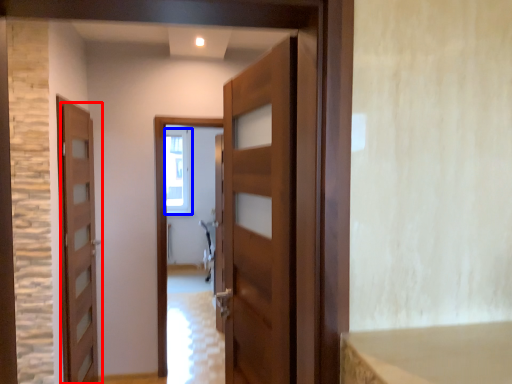
Question: Which object appears closest to the camera in this image, door (highlighted by a red box) or window (highlighted by a blue box)?

Choices:
 (A) door
 (B) window

Answer: (A)